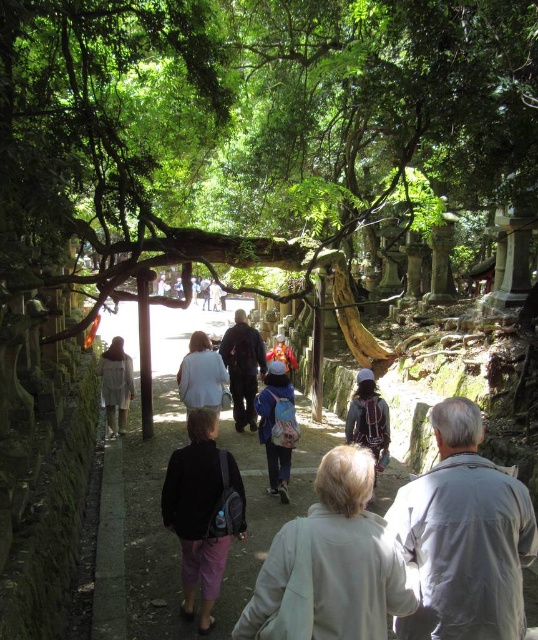
Question: Does smooth stone path at center have a greater width compared to matte black jacket at center?

Choices:
 (A) no
 (B) yes

Answer: (B)

Question: Is smooth stone path at center bigger than light beige fabric jacket at center?

Choices:
 (A) no
 (B) yes

Answer: (B)

Question: Estimate the real-world distances between objects in this image. Which object is closer to the light beige fabric jacket at center?

Choices:
 (A) pastel blue backpack at center
 (B) matte black jacket at center

Answer: (A)

Question: Is light beige jacket at center smaller than light beige fabric dress at center?

Choices:
 (A) yes
 (B) no

Answer: (A)

Question: Which of the following is the farthest from the observer?

Choices:
 (A) (292, 442)
 (B) (239, 369)
 (C) (328, 573)

Answer: (B)

Question: Which point appears farthest from the camera in this image?

Choices:
 (A) (240, 387)
 (B) (157, 492)

Answer: (A)